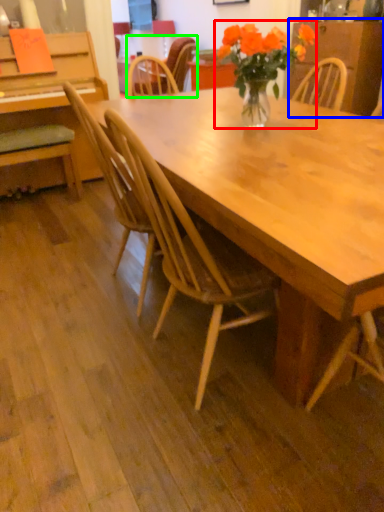
Question: Which object is the farthest from houseplant (highlighted by a red box)? Choose among these: dresser (highlighted by a blue box) or chair (highlighted by a green box).

Choices:
 (A) dresser
 (B) chair

Answer: (A)